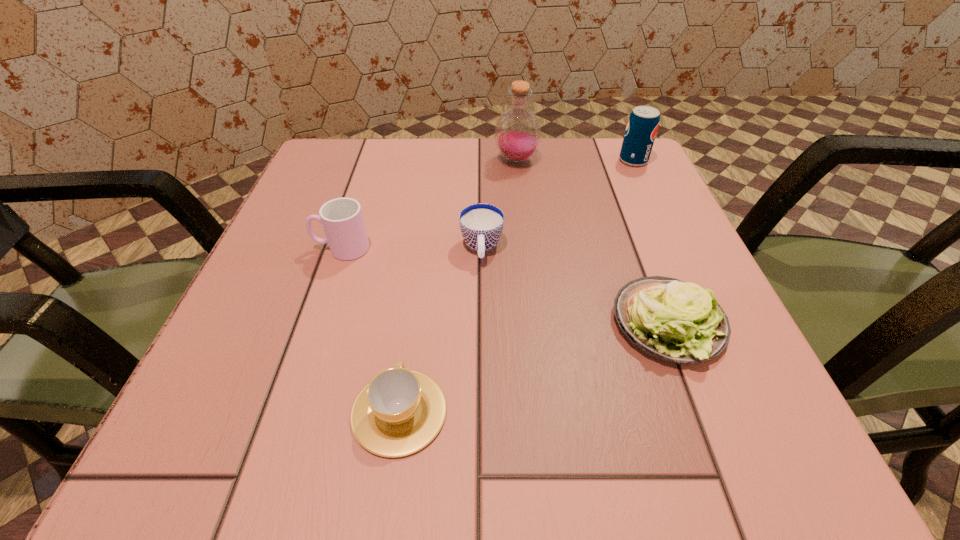
What are the coordinates of `empty space that is in between the pop and the fifth object from right to left` in the screenshot? It's located at (516, 286).

Find the location of `vacant point located between the lettuce and the fifth object from right to left`. vacant point located between the lettuce and the fifth object from right to left is located at coordinates (534, 368).

Locate an element on the screen. This screenshot has width=960, height=540. free space between the fifth object from right to left and the lettuce is located at coordinates (534, 368).

The image size is (960, 540). I want to click on vacant space in between the fifth shortest object and the lettuce, so click(x=651, y=242).

Image resolution: width=960 pixels, height=540 pixels. What are the coordinates of `vacant space that is in between the rightmost cup and the lettuce` in the screenshot? It's located at (575, 286).

Locate an element on the screen. This screenshot has height=540, width=960. empty location between the leftmost object and the lettuce is located at coordinates (505, 286).

This screenshot has height=540, width=960. Identify the location of empty space between the rightmost cup and the leftmost object. (412, 248).

What are the coordinates of `free space between the rightmost cup and the pop` in the screenshot? It's located at (558, 205).

This screenshot has height=540, width=960. In order to click on vacant space in between the rightmost cup and the fifth shortest object in this screenshot , I will do `click(558, 205)`.

Locate an element on the screen. Image resolution: width=960 pixels, height=540 pixels. object that is the second closest to the second tallest object is located at coordinates (481, 224).